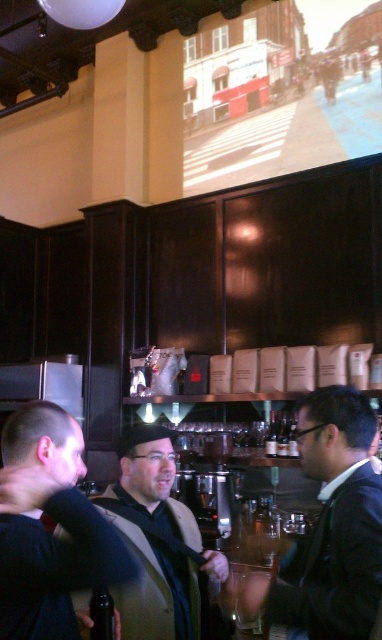
Does dark brown leather jacket at center appear on the left side of dark gray suit at center?

Incorrect, dark brown leather jacket at center is not on the left side of dark gray suit at center.

Looking at this image, which is more to the right, dark brown leather jacket at center or dark gray suit at center?

Positioned to the right is dark brown leather jacket at center.

At what (x,y) coordinates should I click in order to perform the action: click on dark brown leather jacket at center. Please return your answer as a coordinate pair (x, y). This screenshot has width=382, height=640. Looking at the image, I should click on (331, 525).

Can you confirm if dark blue sweater at center is taller than dark gray suit at center?

Incorrect, dark blue sweater at center's height is not larger of dark gray suit at center's.

Does point (79, 512) come in front of point (119, 451)?

Yes, it is.

The height and width of the screenshot is (640, 382). Find the location of `dark blue sweater at center`. dark blue sweater at center is located at coordinates (48, 534).

Can you confirm if dark brown leather jacket at center is positioned to the left of dark blue sweater at center?

No, dark brown leather jacket at center is not to the left of dark blue sweater at center.

Who is more forward, (x=320, y=550) or (x=11, y=438)?

Point (x=11, y=438) is more forward.

Image resolution: width=382 pixels, height=640 pixels. Find the location of `dark brown leather jacket at center`. dark brown leather jacket at center is located at coordinates (331, 525).